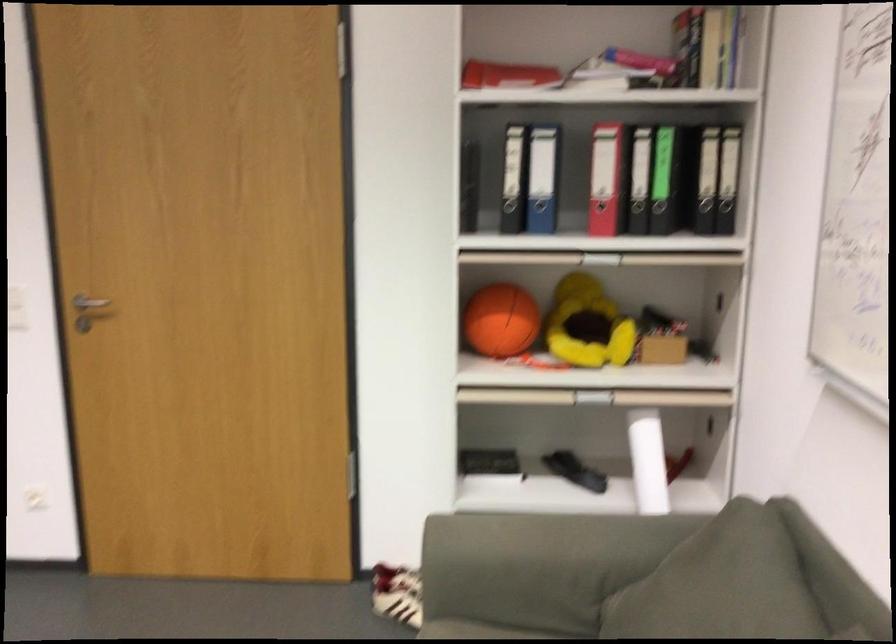
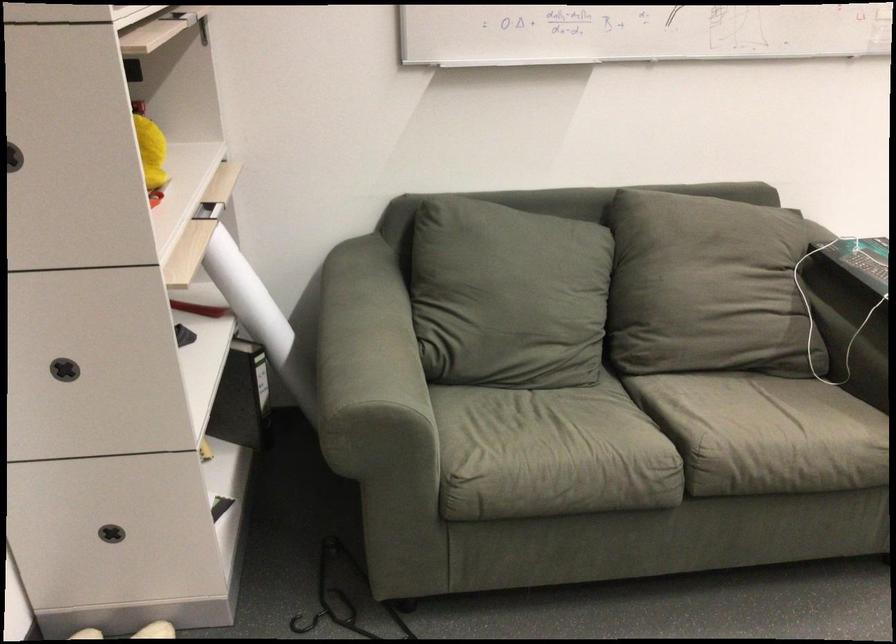
Find the pixel in the second image that matches the point at 521,523 in the first image.

(358, 342)